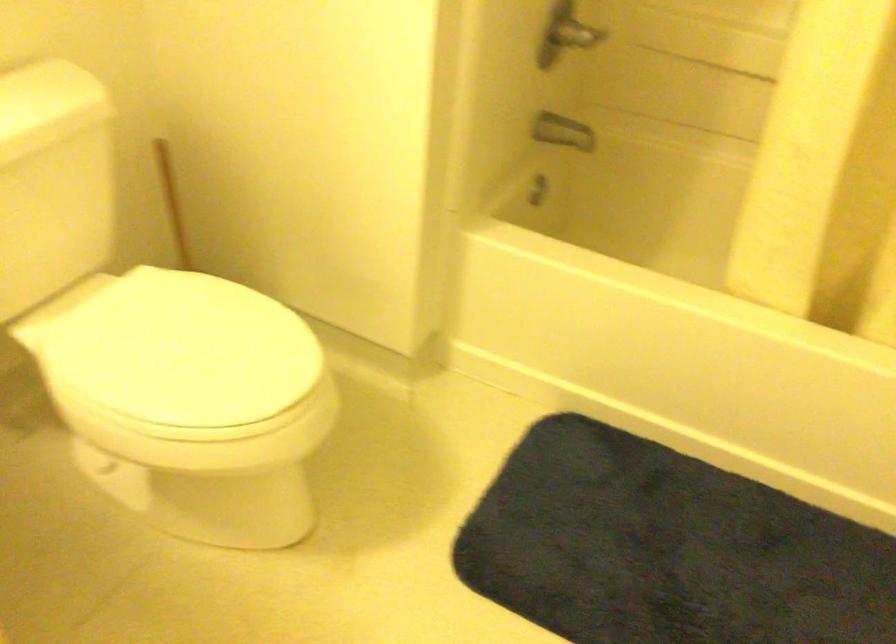
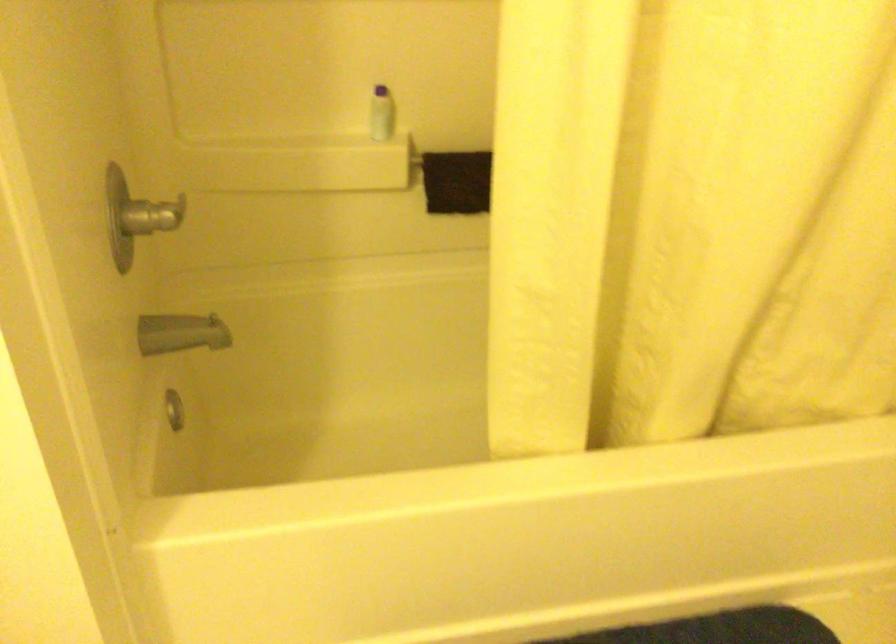
Locate, in the second image, the point that corresponds to pixel 538 187 in the first image.

(174, 410)